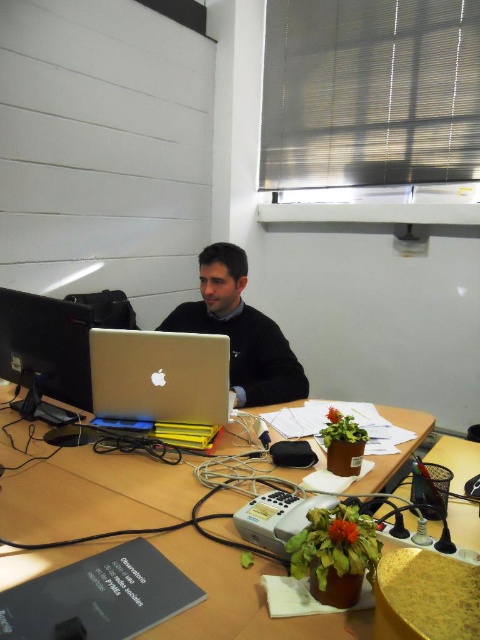
Question: Which of the following is the closest to the observer?

Choices:
 (A) (106, 378)
 (B) (61, 385)

Answer: (A)

Question: Is matte black sweater at center below matte black monitor at left?

Choices:
 (A) no
 (B) yes

Answer: (A)

Question: Which point is farther to the camera?

Choices:
 (A) silver metallic laptop at center
 (B) matte black monitor at left

Answer: (B)

Question: Which of the following is the closest to the observer?

Choices:
 (A) (395, 464)
 (B) (34, 342)
 (C) (123, 346)
 (D) (252, 310)

Answer: (A)

Question: Is wooden at center closer to the viewer compared to matte black sweater at center?

Choices:
 (A) no
 (B) yes

Answer: (B)

Question: Considering the relative positions of wooden at center and silver metallic laptop at center in the image provided, where is wooden at center located with respect to silver metallic laptop at center?

Choices:
 (A) below
 (B) above

Answer: (A)